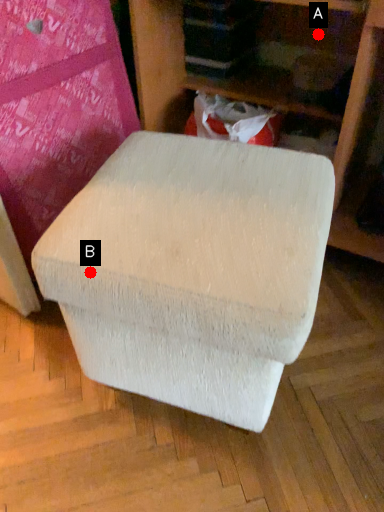
Question: Two points are circled on the image, labeled by A and B beside each circle. Which point is farther to the camera?

Choices:
 (A) A is further
 (B) B is further

Answer: (A)